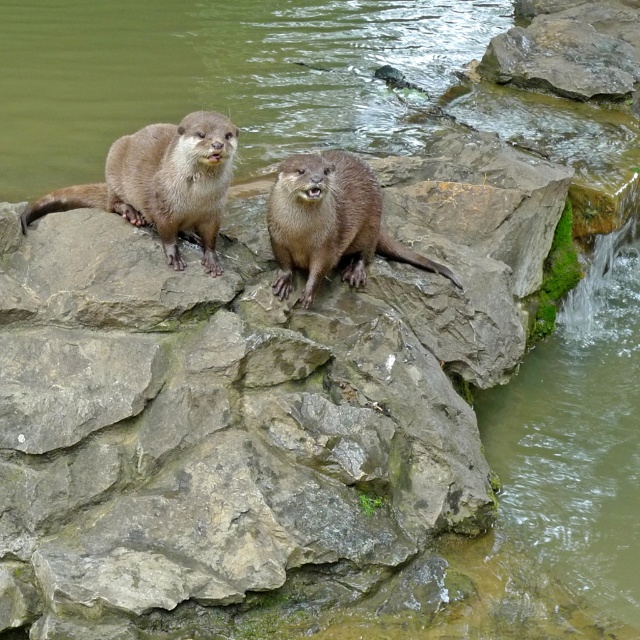
You are an animal researcher observing two brown furry otters in their natural habitat. You notice the brown furry otter at upper left and the brown furry otter at center. Which otter is taller?

The brown furry otter at center is taller than the brown furry otter at upper left.

You are an observer standing near the rocky outcrop where the two brown furry otters are. Which otter, the brown furry otter at upper left or the brown furry otter at center, is nearer to you?

The brown furry otter at upper left is closer to the viewer than the brown furry otter at center, so the brown furry otter at upper left is nearer to you.